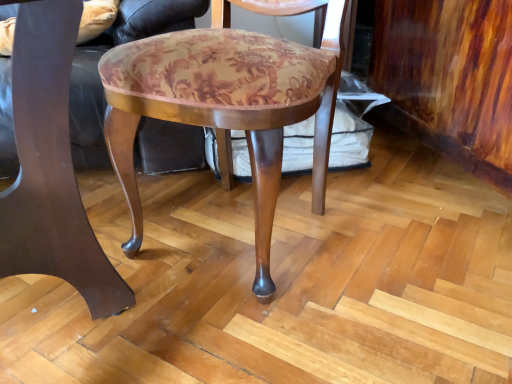
Identify the location of vacant space underneath matte brown wood chair at center, the 1th chair from the left (from a real-world perspective). (66, 332).